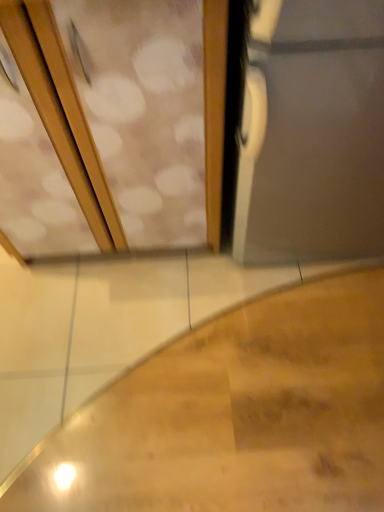
Question: From the image's perspective, is wooden stairs at lower left on top of wooden screen door at upper left?

Choices:
 (A) no
 (B) yes

Answer: (A)

Question: Is wooden stairs at lower left facing away from wooden screen door at upper left?

Choices:
 (A) yes
 (B) no

Answer: (B)

Question: Can you confirm if wooden stairs at lower left is wider than wooden screen door at upper left?

Choices:
 (A) no
 (B) yes

Answer: (B)

Question: Can you confirm if wooden stairs at lower left is bigger than wooden screen door at upper left?

Choices:
 (A) no
 (B) yes

Answer: (A)

Question: Is wooden stairs at lower left not inside wooden screen door at upper left?

Choices:
 (A) yes
 (B) no

Answer: (A)

Question: From a real-world perspective, is wooden stairs at lower left located beneath wooden screen door at upper left?

Choices:
 (A) no
 (B) yes

Answer: (B)

Question: Is wooden stairs at lower left surrounded by wooden screen door at upper left?

Choices:
 (A) yes
 (B) no

Answer: (B)

Question: From the image's perspective, is wooden screen door at upper left under wooden stairs at lower left?

Choices:
 (A) no
 (B) yes

Answer: (A)

Question: Does wooden screen door at upper left appear on the right side of wooden stairs at lower left?

Choices:
 (A) yes
 (B) no

Answer: (B)

Question: Is wooden screen door at upper left to the left of wooden stairs at lower left from the viewer's perspective?

Choices:
 (A) yes
 (B) no

Answer: (A)

Question: Is wooden screen door at upper left taller than wooden stairs at lower left?

Choices:
 (A) yes
 (B) no

Answer: (A)

Question: From the image's perspective, is wooden screen door at upper left on top of wooden stairs at lower left?

Choices:
 (A) no
 (B) yes

Answer: (B)

Question: Is wooden stairs at lower left in front of or behind wooden screen door at upper left in the image?

Choices:
 (A) front
 (B) behind

Answer: (B)